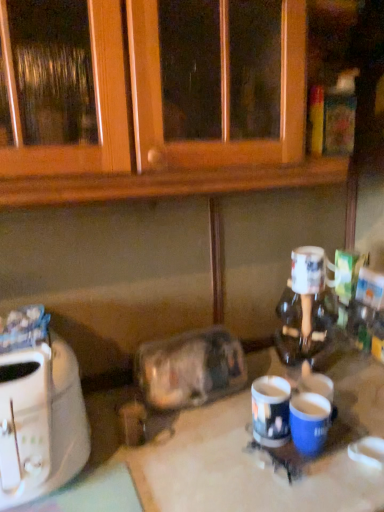
Question: In terms of width, does transparent plastic container at center look wider or thinner when compared to white glossy mug at right, which appears as the first coffee cup when viewed from the top?

Choices:
 (A) wide
 (B) thin

Answer: (A)

Question: Is transparent plastic container at center bigger or smaller than white glossy mug at right, positioned as the third coffee cup in bottom-to-top order?

Choices:
 (A) small
 (B) big

Answer: (B)

Question: Which is farther from the white plastic toaster at left?

Choices:
 (A) blue glossy mug at center, the 2th coffee cup when ordered from top to bottom
 (B) white glossy table at center
 (C) white glossy mug at right, positioned as the third coffee cup in bottom-to-top order
 (D) transparent plastic container at center
 (E) blue matte mug at lower center, which is the 3th coffee cup from top to bottom

Answer: (C)

Question: Considering the real-world distances, which object is closest to the white glossy mug at right, which appears as the first coffee cup when viewed from the top?

Choices:
 (A) white plastic toaster at left
 (B) transparent plastic container at center
 (C) blue matte mug at lower center, the 1th coffee cup from the bottom
 (D) blue glossy mug at center, positioned as the second coffee cup in bottom-to-top order
 (E) white glossy table at center

Answer: (D)